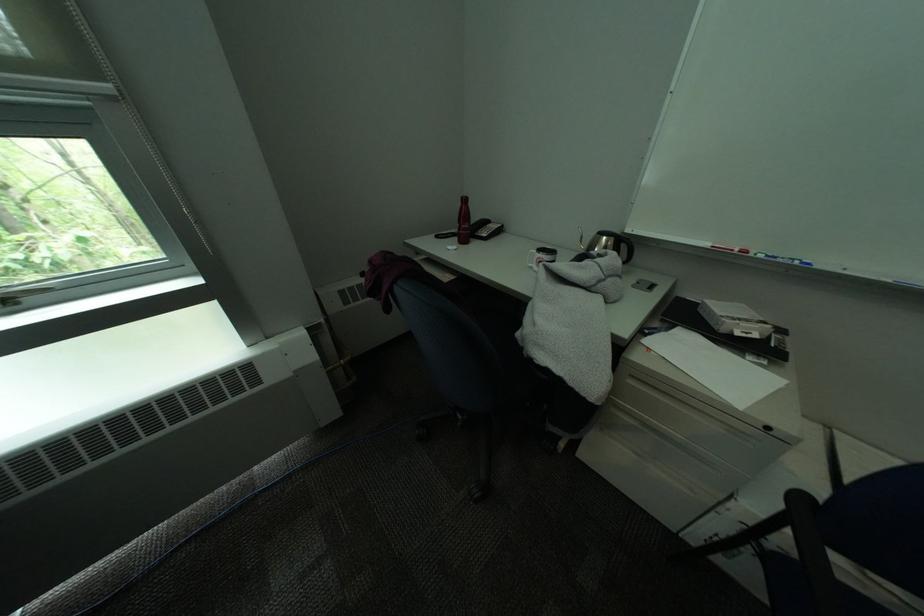
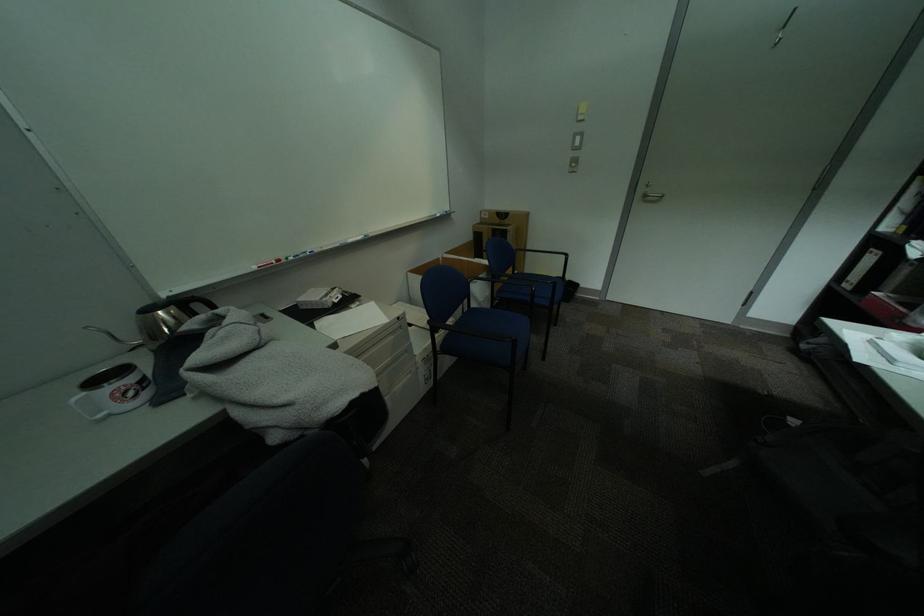
How did the camera likely rotate?

The camera rotated toward right-down.